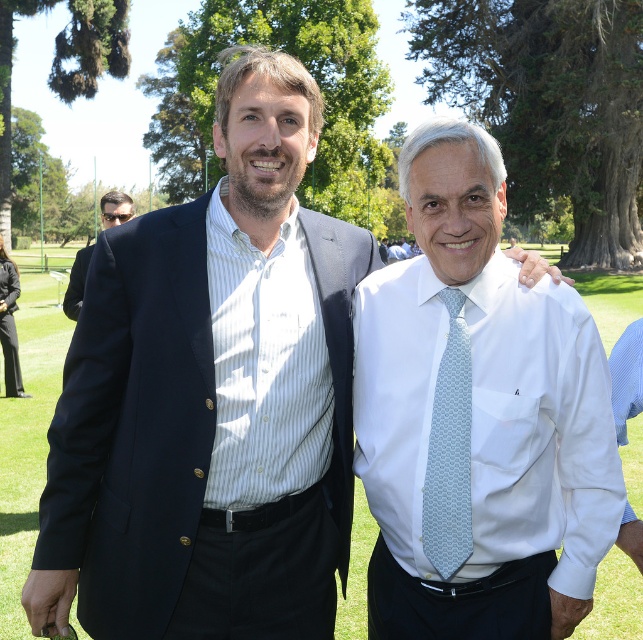
Question: Does white silk shirt at center have a lesser width compared to sunglasses at left?

Choices:
 (A) yes
 (B) no

Answer: (A)

Question: Which point is farther to the camera?

Choices:
 (A) white silk shirt at center
 (B) dark blue wool suit at left
 (C) light blue woven tie at center

Answer: (B)

Question: Is white silk shirt at center to the right of black fabric business suit at left from the viewer's perspective?

Choices:
 (A) yes
 (B) no

Answer: (A)

Question: Which point is closer to the camera?

Choices:
 (A) (439, 481)
 (B) (69, 280)
 (C) (439, 500)
 (D) (5, 257)

Answer: (C)

Question: Does black fabric business suit at left have a greater width compared to dark blue wool suit at left?

Choices:
 (A) no
 (B) yes

Answer: (A)

Question: Based on their relative distances, which object is farther from the sunglasses at left?

Choices:
 (A) white silk shirt at center
 (B) dark blue wool suit at left

Answer: (A)